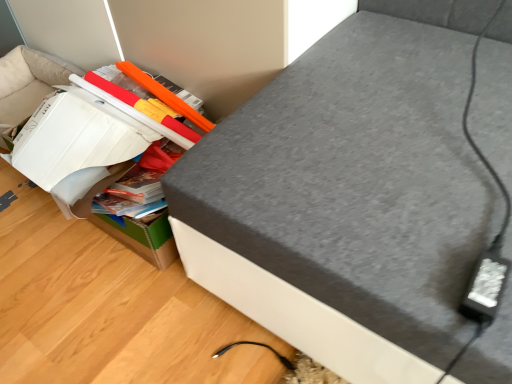
Question: Considering the positions of grey fabric ottoman at upper right and cardboard box at lower left in the image, is grey fabric ottoman at upper right wider or thinner than cardboard box at lower left?

Choices:
 (A) thin
 (B) wide

Answer: (B)

Question: Is grey fabric ottoman at upper right to the left or to the right of cardboard box at lower left in the image?

Choices:
 (A) left
 (B) right

Answer: (B)

Question: Relative to cardboard box at lower left, is grey fabric ottoman at upper right in front or behind?

Choices:
 (A) front
 (B) behind

Answer: (A)

Question: Is cardboard box at lower left spatially inside grey fabric ottoman at upper right, or outside of it?

Choices:
 (A) inside
 (B) outside

Answer: (B)

Question: In terms of height, does cardboard box at lower left look taller or shorter compared to grey fabric ottoman at upper right?

Choices:
 (A) short
 (B) tall

Answer: (A)

Question: From a real-world perspective, is cardboard box at lower left positioned above or below grey fabric ottoman at upper right?

Choices:
 (A) above
 (B) below

Answer: (B)

Question: Is cardboard box at lower left bigger or smaller than grey fabric ottoman at upper right?

Choices:
 (A) big
 (B) small

Answer: (B)